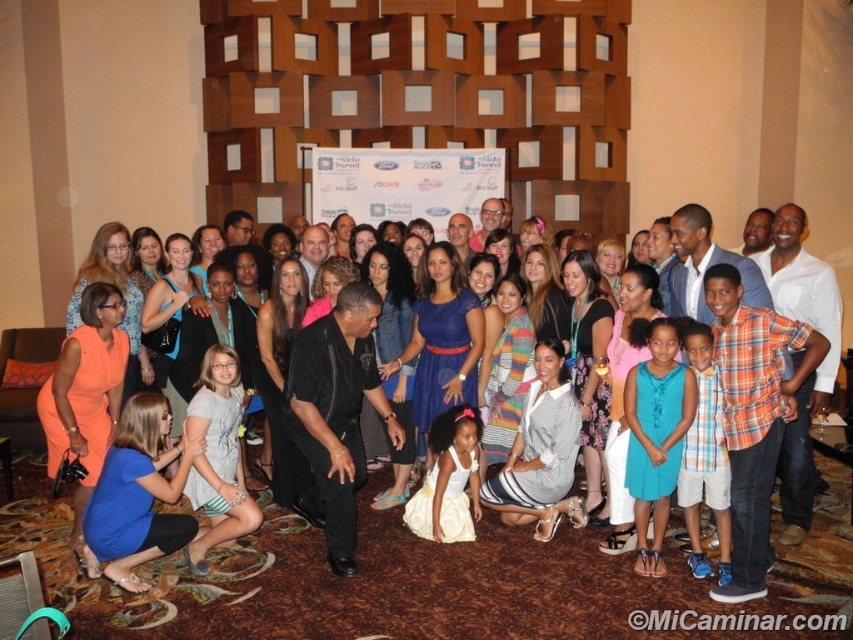
You are a photographer at the event and want to ensure both the plaid sleeveless shirt at center and the white satin dress at center are visible in the photo. Which one should you focus on first if you need to adjust the framing to include both?

The plaid sleeveless shirt at center is to the right of the white satin dress at center, so you should focus on the white satin dress at center first to ensure both are included in the frame.

In the group photo, there are two people wearing a black matte dress at center and a plaid sleeveless shirt at center. Which clothing item is positioned to the right of the other?

The black matte dress at center is to the right of the plaid sleeveless shirt at center.

You are standing in the group photo and want to move from your current position at point (677, 499) to the exit located at point (450, 442). Considering the semi circular arrangement of the group, which direction should you move to reach the exit?

Since point (677, 499) is closer to the camera than point (450, 442), you should move forward towards the center of the semi circle to reach the exit at point (450, 442).